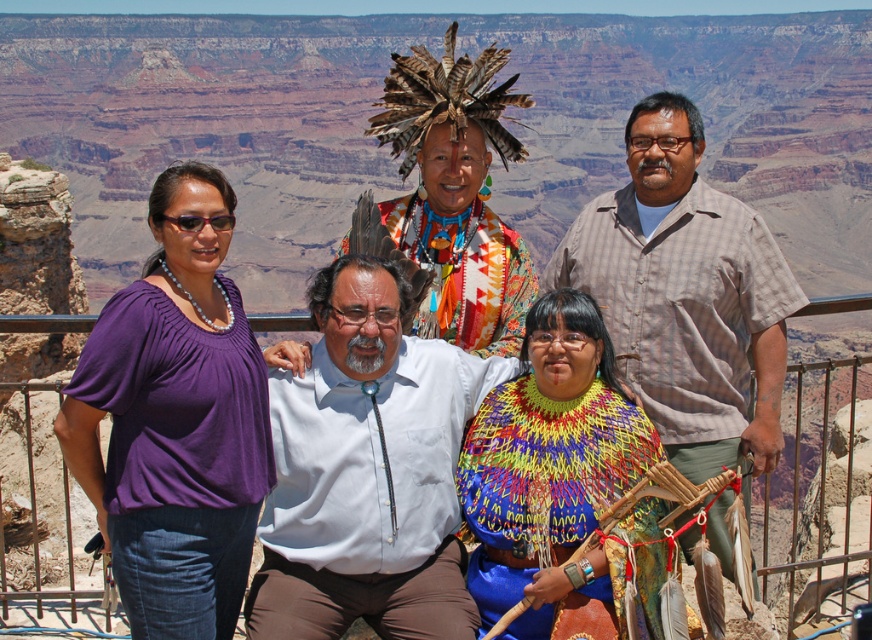
You are standing at the overlook and want to take a closer look at the two points marked in the image. Which point, point (134, 435) or point (387, 449), is nearer to you?

Point (134, 435) is closer to the viewer than point (387, 449).

You are a photographer trying to capture a detailed shot of the white cotton shirt at center and the plaid shirt at center. Which one is lower in the frame?

The white cotton shirt at center is positioned under the plaid shirt at center, so it is lower in the frame.

You are a photographer trying to adjust the camera focus to capture both the purple fabric shirt at left and the plaid shirt at center clearly. Which of the two shirts should you focus on first to ensure proper depth of field?

→ The purple fabric shirt at left is not as tall as plaid shirt at center, so focusing on the plaid shirt at center first would help achieve proper depth of field as it is taller and might require more attention in the frame.